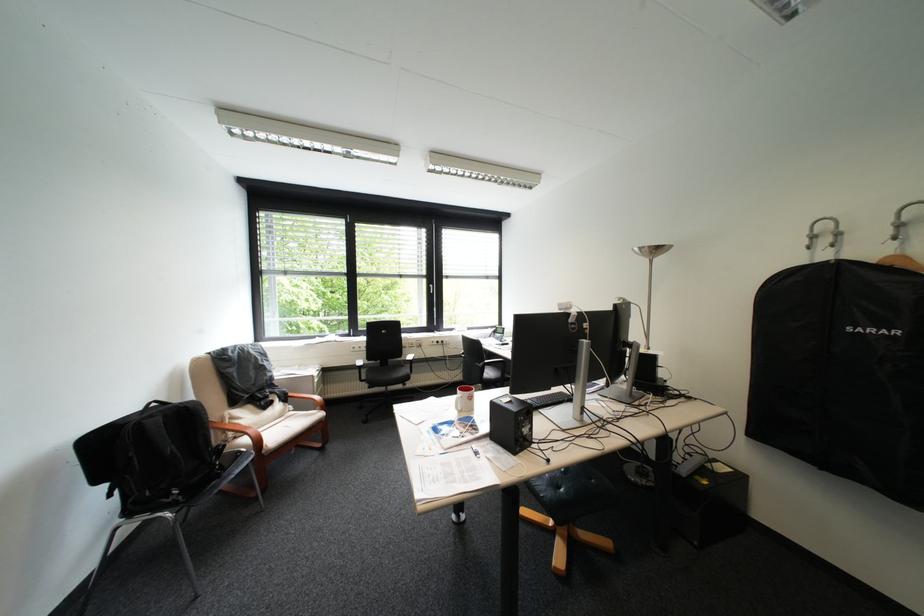
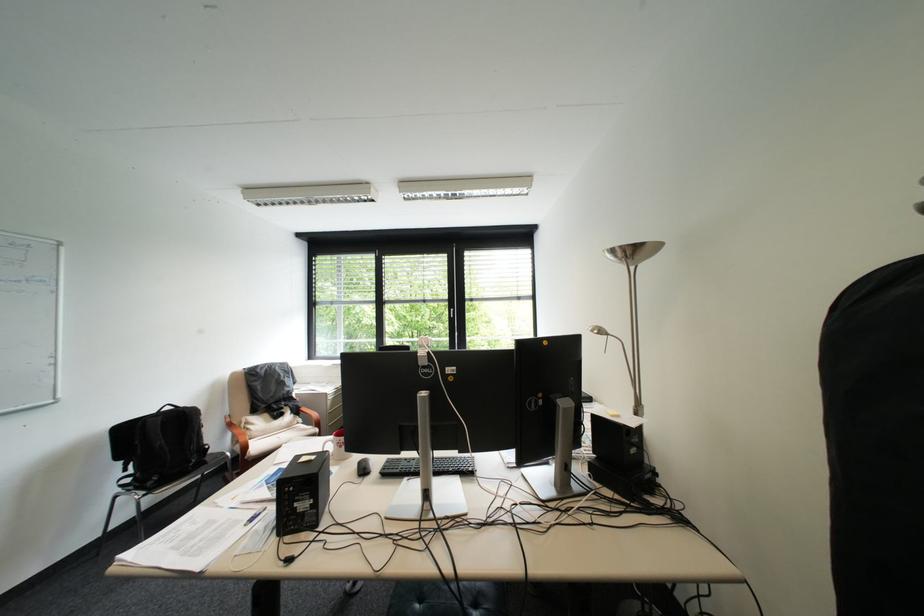
Where in the second image is the point corresponding to (199,407) from the first image?

(198, 411)